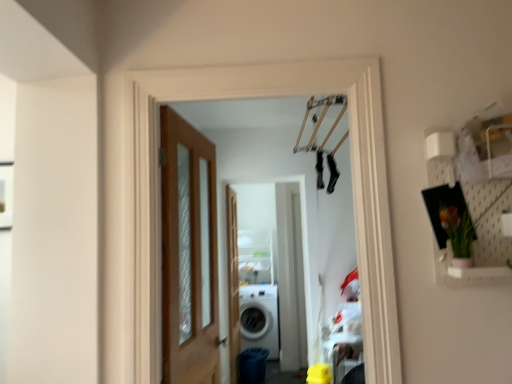
Question: Is white glossy washing machine at center bigger or smaller than clear wood screen door at center?

Choices:
 (A) big
 (B) small

Answer: (A)

Question: Choose the correct answer: Is white glossy washing machine at center inside clear wood screen door at center or outside it?

Choices:
 (A) outside
 (B) inside

Answer: (A)

Question: Which object is positioned farthest from the clear wood screen door at center?

Choices:
 (A) wooden door at left
 (B) white glossy washing machine at center

Answer: (A)

Question: Which object is positioned farthest from the wooden door at left?

Choices:
 (A) clear wood screen door at center
 (B) white glossy washing machine at center

Answer: (B)